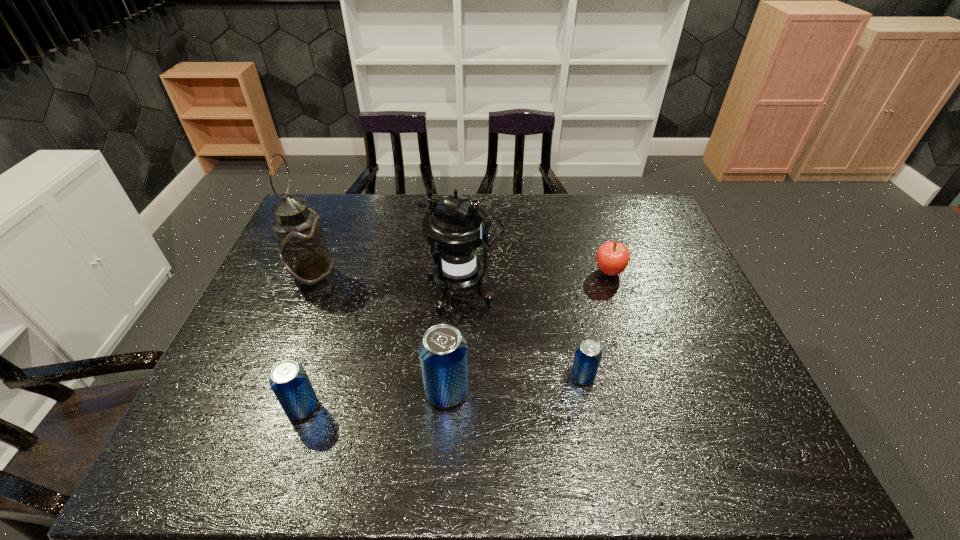
Locate an element on the screen. The width and height of the screenshot is (960, 540). the leftmost beer can is located at coordinates (289, 381).

Locate an element on the screen. This screenshot has height=540, width=960. the third shortest object is located at coordinates (289, 381).

Find the location of a particular element. This screenshot has height=540, width=960. the tallest beer can is located at coordinates (443, 350).

This screenshot has width=960, height=540. In order to click on the fourth shortest object in this screenshot , I will do `click(443, 350)`.

Identify the location of the rightmost beer can. The width and height of the screenshot is (960, 540). (588, 355).

Image resolution: width=960 pixels, height=540 pixels. What are the coordinates of `the fifth object from left to right` in the screenshot? It's located at (588, 355).

Where is `oil lamp`? This screenshot has width=960, height=540. oil lamp is located at coordinates (303, 250).

The image size is (960, 540). Identify the location of apple. (612, 258).

The height and width of the screenshot is (540, 960). I want to click on lantern, so click(x=455, y=228).

This screenshot has height=540, width=960. What are the coordinates of `blank space located 0.090m on the right of the second shortest beer can` in the screenshot? It's located at (358, 407).